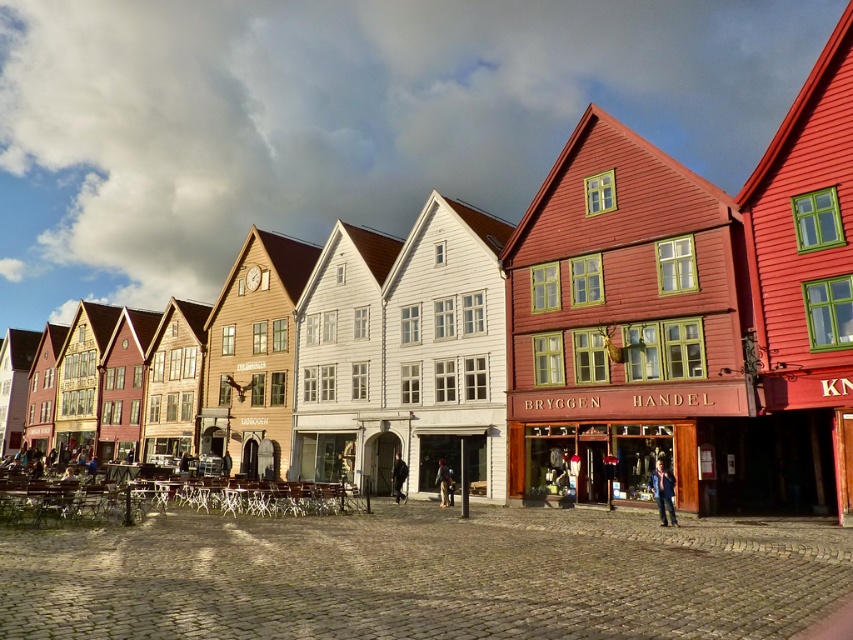
Question: Is blue denim jacket at lower right thinner than black leather jacket at center?

Choices:
 (A) yes
 (B) no

Answer: (B)

Question: Which object appears farthest from the camera in this image?

Choices:
 (A) wooden shop at center
 (B) dark blue jeans at center
 (C) black leather jacket at center

Answer: (C)

Question: Which object is positioned closest to the dark blue jeans at center?

Choices:
 (A) blue denim jacket at lower right
 (B) black leather jacket at center
 (C) wooden shop at center

Answer: (B)

Question: Which object appears farthest from the camera in this image?

Choices:
 (A) blue denim jacket at lower right
 (B) wooden shop at center
 (C) black leather jacket at center

Answer: (C)

Question: Is blue denim jacket at lower right smaller than black leather jacket at center?

Choices:
 (A) yes
 (B) no

Answer: (B)

Question: Considering the relative positions of blue denim jacket at lower right and black leather jacket at center in the image provided, where is blue denim jacket at lower right located with respect to black leather jacket at center?

Choices:
 (A) right
 (B) left

Answer: (A)